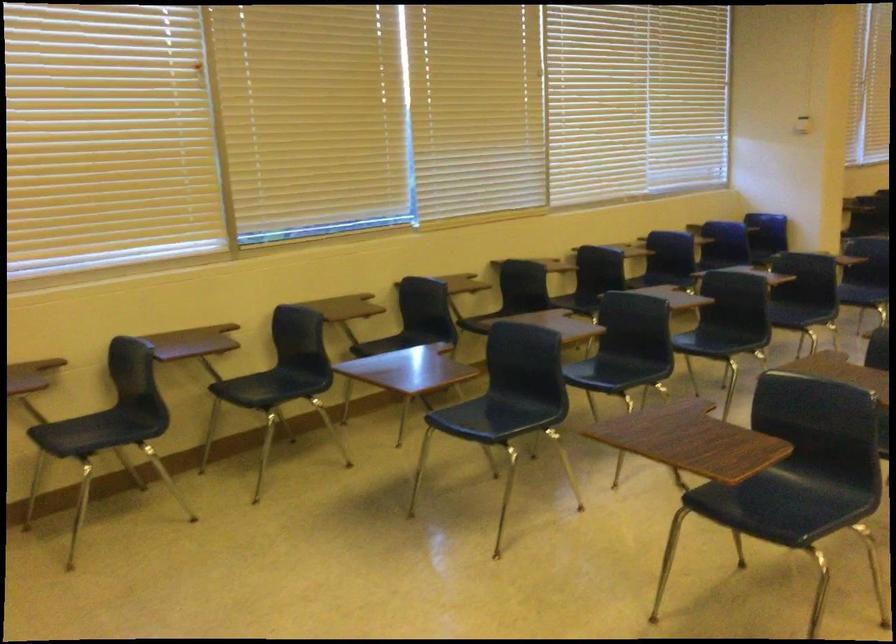
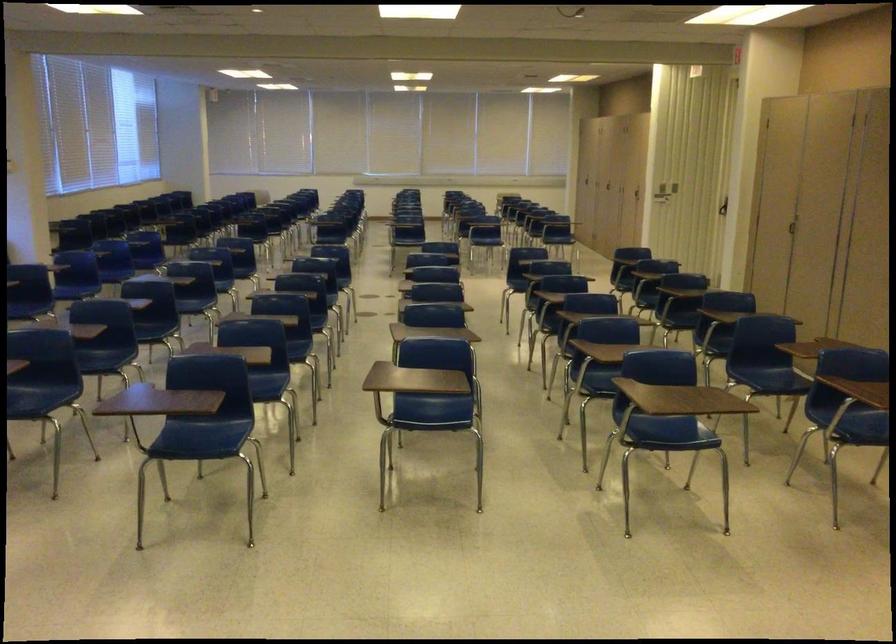
In the second image, find the point that corresponds to [799,498] in the first image.

(39, 395)